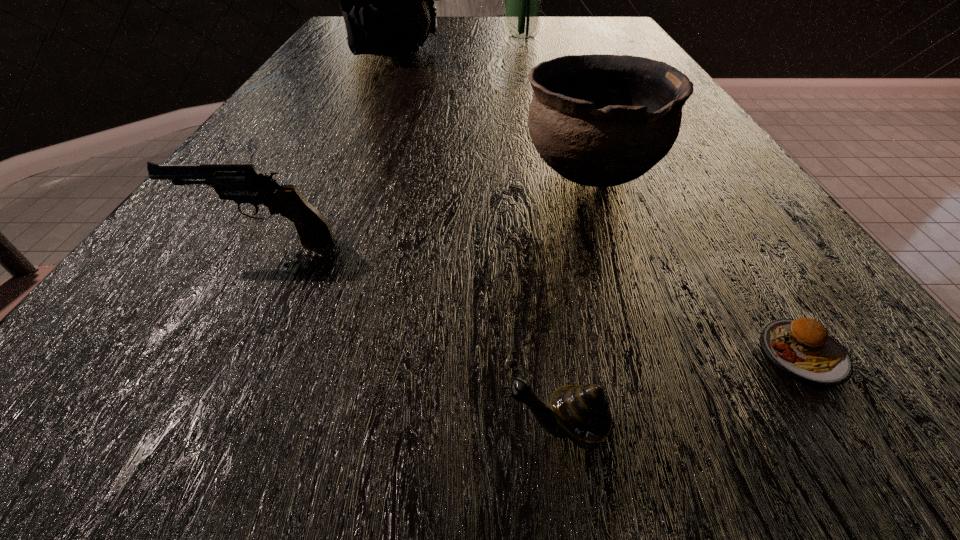
This screenshot has width=960, height=540. In order to click on free space located on the front-facing side of the bouquet in this screenshot , I will do `click(380, 38)`.

You are a GUI agent. You are given a task and a screenshot of the screen. Output one action in this format:
    pyautogui.click(x=<x>, y=<y>)
    Task: Click on the vacant space located on the front-facing side of the bouquet
    The image size is (960, 540).
    Given the screenshot: What is the action you would take?
    pyautogui.click(x=487, y=38)

Where is `vacant space situated 0.090m on the front-facing side of the bouquet`? vacant space situated 0.090m on the front-facing side of the bouquet is located at coordinates (472, 38).

Locate an element on the screen. The width and height of the screenshot is (960, 540). free spot located 0.310m on the open flap of the second tallest object is located at coordinates (556, 50).

Where is `free location located on the back of the pottery`? The width and height of the screenshot is (960, 540). free location located on the back of the pottery is located at coordinates (571, 111).

Identify the location of vacant area located on the face of the second shortest object. This screenshot has height=540, width=960. (282, 428).

This screenshot has height=540, width=960. I want to click on free point located on the face of the second shortest object, so (x=282, y=428).

Find the location of a particular element. The height and width of the screenshot is (540, 960). free space located on the face of the second shortest object is located at coordinates (250, 428).

Where is `free space located 0.160m on the left of the shortest object`? This screenshot has height=540, width=960. free space located 0.160m on the left of the shortest object is located at coordinates (610, 353).

This screenshot has width=960, height=540. Find the location of `bouquet that is positioned at the far edge`. bouquet that is positioned at the far edge is located at coordinates (523, 0).